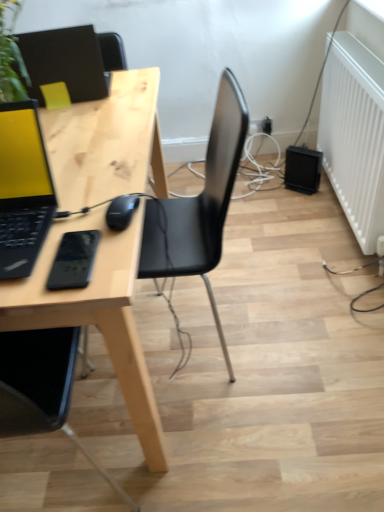
The width and height of the screenshot is (384, 512). Find the location of `vacant area that lies between black matte mouse at center and matte black laptop at left, acting as the 2th laptop starting from the top`. vacant area that lies between black matte mouse at center and matte black laptop at left, acting as the 2th laptop starting from the top is located at coordinates (82, 219).